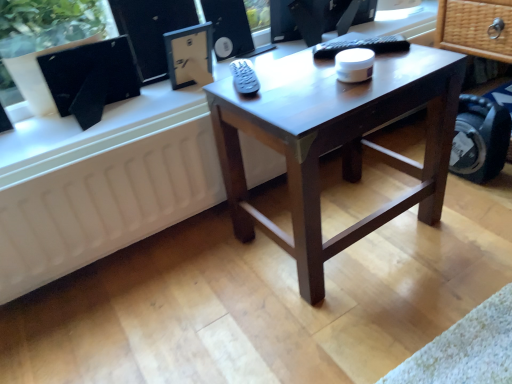
Question: Is point (129, 76) closer or farther from the camera than point (212, 24)?

Choices:
 (A) farther
 (B) closer

Answer: (B)

Question: Is black matte computer monitor at upper left spatially inside matte black speaker at upper center, or outside of it?

Choices:
 (A) outside
 (B) inside

Answer: (A)

Question: Which is nearer to the matte dark brown coffee table at center?

Choices:
 (A) white matte radiator at lower left
 (B) black matte computer monitor at upper left
 (C) matte black speaker at upper center

Answer: (A)

Question: Estimate the real-world distances between objects in this image. Which object is closer to the matte black speaker at upper center?

Choices:
 (A) white matte radiator at lower left
 (B) matte dark brown coffee table at center
 (C) black matte computer monitor at upper left

Answer: (C)